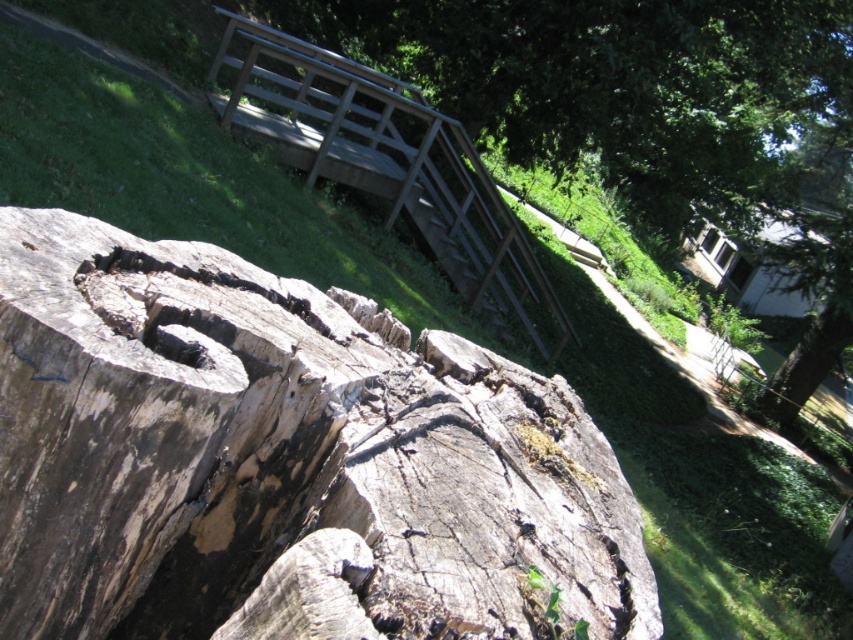
Question: Can you confirm if wooden rail at upper center is bigger than smooth brown tree trunk at upper right?

Choices:
 (A) no
 (B) yes

Answer: (A)

Question: From the image, what is the correct spatial relationship of wooden rail at upper center in relation to smooth brown tree trunk at upper right?

Choices:
 (A) below
 (B) above

Answer: (B)

Question: Which point is farther from the camera taking this photo?

Choices:
 (A) (773, 412)
 (B) (434, 138)

Answer: (A)

Question: Can you confirm if wooden rail at upper center is positioned to the left of smooth brown tree trunk at upper right?

Choices:
 (A) no
 (B) yes

Answer: (B)